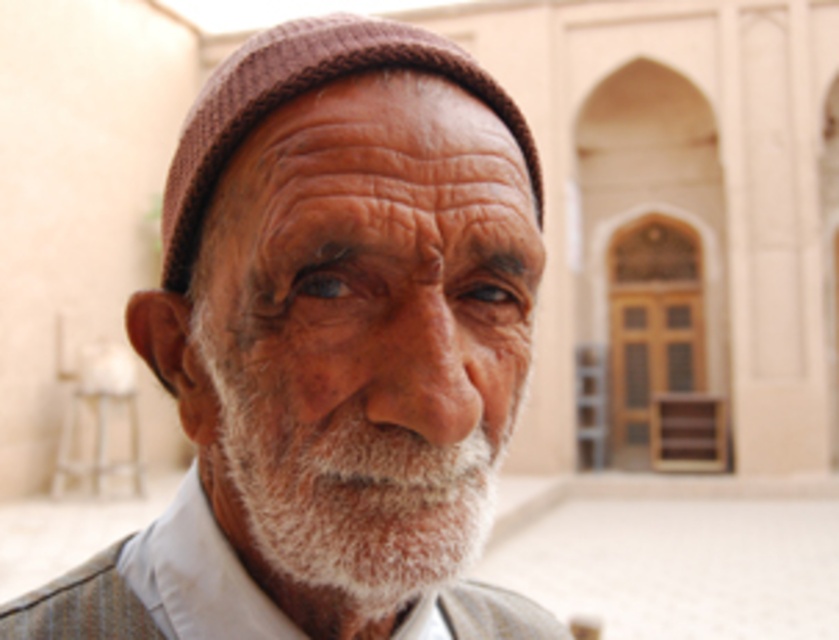
You are an architect designing a new building and need to place a statue of the elderly man in the courtyard. The statue will be placed at the point with coordinates [331,349]. What object should the statue be positioned relative to?

The point [331,349] corresponds to the white woolen cap at center, so the statue should be positioned relative to the white woolen cap at center.

You are an artist sketching this elderly man. You notice the white soft beard at center and the knitted brown hat at center. Which object is located lower on his face?

The white soft beard at center is positioned under the knitted brown hat at center, so it is located lower on his face.